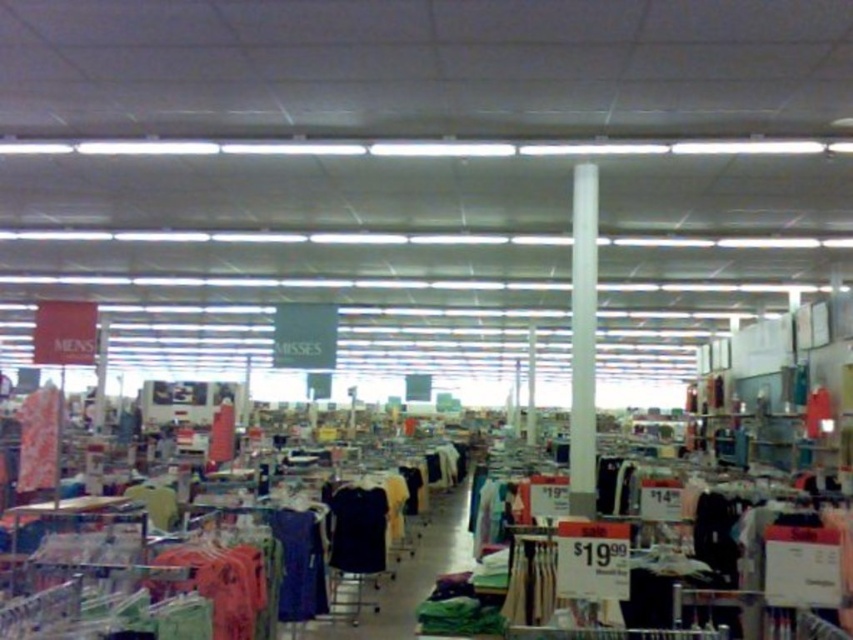
You are a store employee who needs to retrieve both the dark blue fabric shirt at center and the striped fabric shirt at left for a customer. The store has a rule that employees must walk at least 15 feet between any two items they collect to ensure they don not rush. Can you collect both shirts without violating the store policy?

The distance between the dark blue fabric shirt at center and the striped fabric shirt at left is 14.02 feet, which is less than the required 15 feet. Therefore, you cannot collect both shirts without violating the store policy.

You are a customer in a retail store looking to purchase a dark blue fabric dress at center and a striped fabric shirt at left. You want to place both items on a shelf that is 1.2 meters tall. Which item will require you to reach higher to place it on the shelf?

The dark blue fabric dress at center is much taller than the striped fabric shirt at left, so you will need to reach higher to place the dark blue fabric dress at center on the shelf.

You are a customer trying to decide between two shirts in a store. You see the dark blue fabric shirt at center and the striped fabric shirt at left. Which shirt has a wider width?

The dark blue fabric shirt at center has a larger width than the striped fabric shirt at left according to the description.